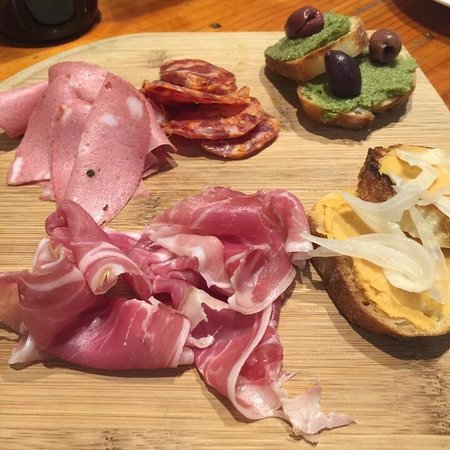
The height and width of the screenshot is (450, 450). What are the coordinates of `yellow spread` in the screenshot? It's located at (375, 284), (393, 165).